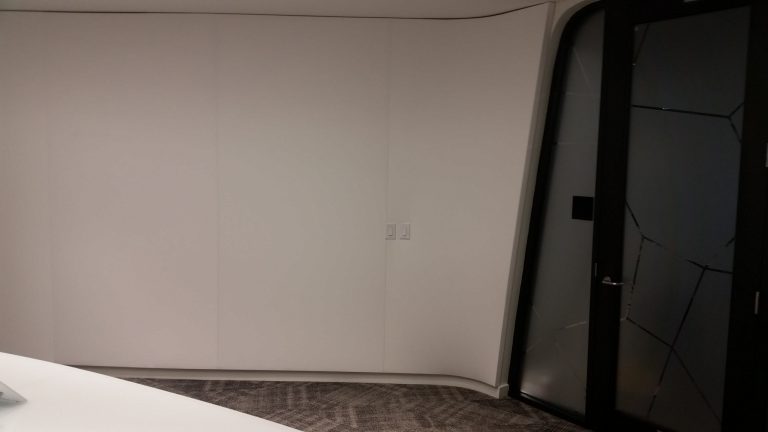
At what (x,y) coordinates should I click in order to perform the action: click on door hinge. Please return your answer as a coordinate pair (x, y). This screenshot has height=432, width=768. Looking at the image, I should click on (755, 299).